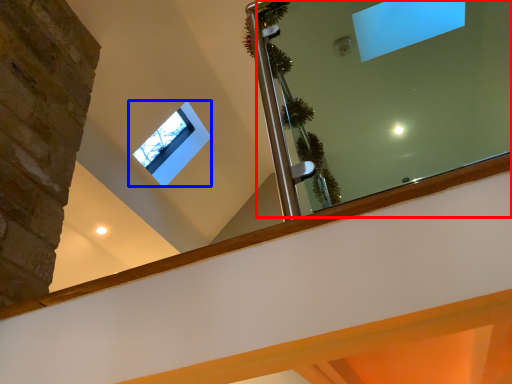
Question: Among these objects, which one is farthest to the camera, mirror (highlighted by a red box) or window (highlighted by a blue box)?

Choices:
 (A) mirror
 (B) window

Answer: (B)